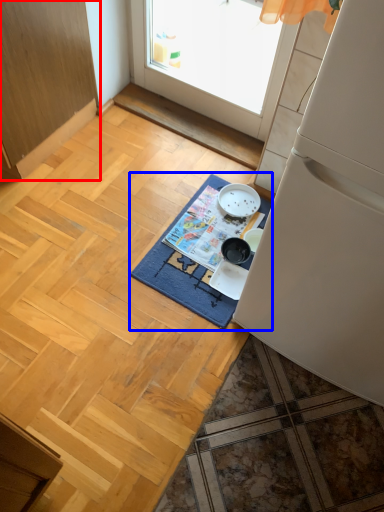
Question: Among these objects, which one is farthest to the camera, cabinetry (highlighted by a red box) or mat (highlighted by a blue box)?

Choices:
 (A) cabinetry
 (B) mat

Answer: (B)